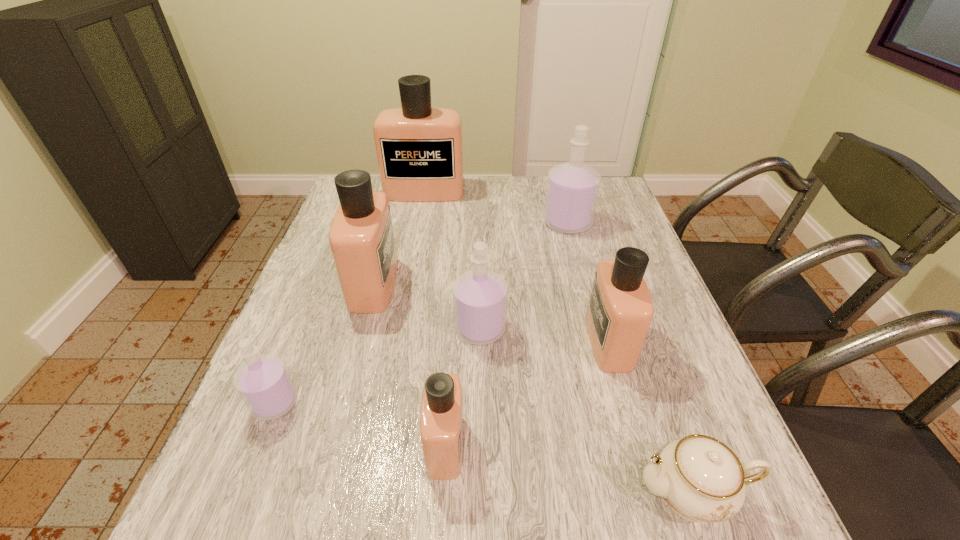
The height and width of the screenshot is (540, 960). Identify the location of the farthest perfume. [419, 148].

This screenshot has height=540, width=960. What are the coordinates of `the farthest object` in the screenshot? It's located at (419, 148).

Locate an element on the screen. This screenshot has height=540, width=960. the second biggest beige perfume is located at coordinates (361, 237).

Where is `the rightmost purple perfume`? This screenshot has width=960, height=540. the rightmost purple perfume is located at coordinates (572, 190).

The height and width of the screenshot is (540, 960). I want to click on the seventh nearest object, so click(x=572, y=190).

You are a GUI agent. You are given a task and a screenshot of the screen. Output one action in this format:
    pyautogui.click(x=<x>, y=<y>)
    Task: Click on the third biggest beige perfume
    This screenshot has height=540, width=960.
    Given the screenshot: What is the action you would take?
    (620, 311)

Where is `the second nearest purple perfume`? Image resolution: width=960 pixels, height=540 pixels. the second nearest purple perfume is located at coordinates (479, 296).

You are a GUI agent. You are given a task and a screenshot of the screen. Output one action in this format:
    pyautogui.click(x=<x>, y=<y>)
    Task: Click on the second smallest purple perfume
    
    Given the screenshot: What is the action you would take?
    pyautogui.click(x=479, y=296)

You are a GUI agent. You are given a task and a screenshot of the screen. Output one action in this format:
    pyautogui.click(x=<x>, y=<y>)
    Task: Click on the smallest purple perfume
    The height and width of the screenshot is (540, 960).
    Given the screenshot: What is the action you would take?
    pyautogui.click(x=263, y=382)

I want to click on the nearest purple perfume, so click(263, 382).